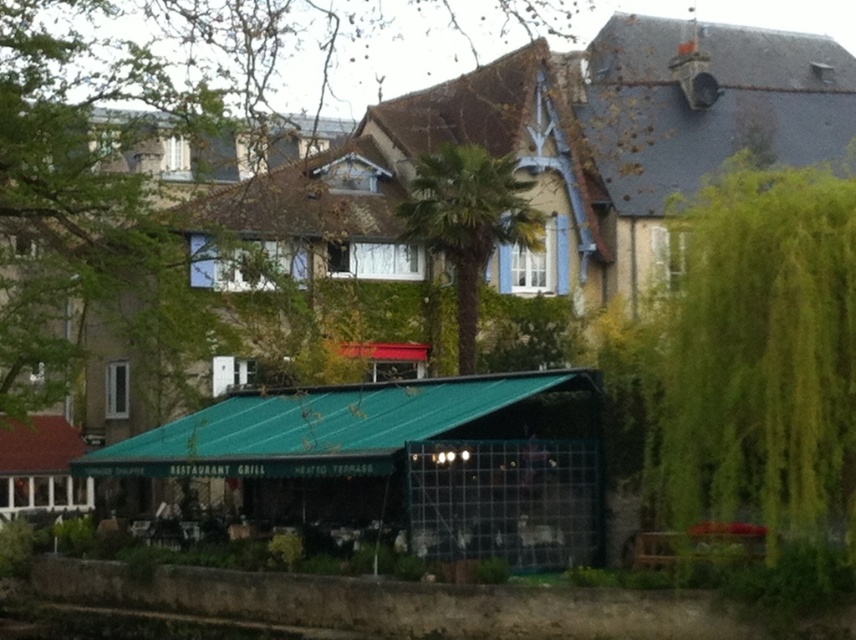
Question: Which object appears farthest from the camera in this image?

Choices:
 (A) green leafy palm tree at center
 (B) green metal awning at center

Answer: (A)

Question: Which object is closer to the camera taking this photo?

Choices:
 (A) green leafy tree at right
 (B) green metal awning at center
 (C) green leafy palm tree at center

Answer: (A)

Question: Observing the image, what is the correct spatial positioning of green metal awning at center in reference to green leafy palm tree at center?

Choices:
 (A) left
 (B) right

Answer: (A)

Question: Is green leafy tree at right wider than green leafy palm tree at center?

Choices:
 (A) no
 (B) yes

Answer: (B)

Question: Estimate the real-world distances between objects in this image. Which object is closer to the green leafy palm tree at center?

Choices:
 (A) green metal awning at center
 (B) green leafy tree at right

Answer: (A)

Question: Is green leafy tree at right closer to the viewer compared to green leafy palm tree at center?

Choices:
 (A) yes
 (B) no

Answer: (A)